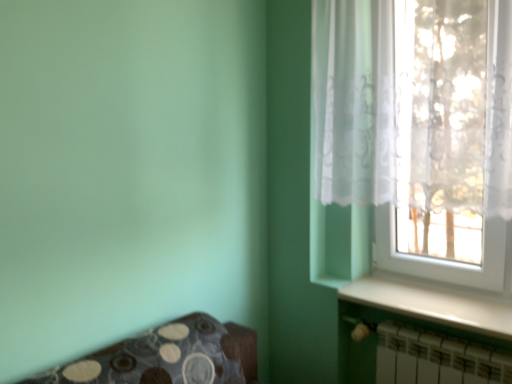
Question: Considering the relative sizes of translucent fabric at upper right and white metallic radiator at lower right in the image provided, is translucent fabric at upper right wider than white metallic radiator at lower right?

Choices:
 (A) no
 (B) yes

Answer: (B)

Question: Is there a large distance between translucent fabric at upper right and white metallic radiator at lower right?

Choices:
 (A) no
 (B) yes

Answer: (A)

Question: Could white metallic radiator at lower right be considered to be inside translucent fabric at upper right?

Choices:
 (A) no
 (B) yes

Answer: (A)

Question: From a real-world perspective, does translucent fabric at upper right stand above white metallic radiator at lower right?

Choices:
 (A) no
 (B) yes

Answer: (B)

Question: Considering the relative sizes of translucent fabric at upper right and white metallic radiator at lower right in the image provided, is translucent fabric at upper right thinner than white metallic radiator at lower right?

Choices:
 (A) yes
 (B) no

Answer: (B)

Question: From the image's perspective, is white metallic radiator at lower right located above or below white glossy window sill at lower right?

Choices:
 (A) below
 (B) above

Answer: (A)

Question: Considering the positions of white metallic radiator at lower right and white glossy window sill at lower right in the image, is white metallic radiator at lower right wider or thinner than white glossy window sill at lower right?

Choices:
 (A) wide
 (B) thin

Answer: (B)

Question: Does point (399, 359) appear closer or farther from the camera than point (466, 304)?

Choices:
 (A) closer
 (B) farther

Answer: (A)

Question: Is white metallic radiator at lower right taller or shorter than white glossy window sill at lower right?

Choices:
 (A) tall
 (B) short

Answer: (A)

Question: Considering the positions of white metallic radiator at lower right and translucent fabric at upper right in the image, is white metallic radiator at lower right bigger or smaller than translucent fabric at upper right?

Choices:
 (A) small
 (B) big

Answer: (A)

Question: From the image's perspective, is white metallic radiator at lower right located above or below translucent fabric at upper right?

Choices:
 (A) above
 (B) below

Answer: (B)

Question: In terms of width, does white metallic radiator at lower right look wider or thinner when compared to translucent fabric at upper right?

Choices:
 (A) thin
 (B) wide

Answer: (A)

Question: From a real-world perspective, relative to translucent fabric at upper right, is white metallic radiator at lower right vertically above or below?

Choices:
 (A) below
 (B) above

Answer: (A)

Question: Would you say translucent fabric at upper right is to the left or to the right of white metallic radiator at lower right in the picture?

Choices:
 (A) right
 (B) left

Answer: (B)

Question: In the image, is translucent fabric at upper right positioned in front of or behind white metallic radiator at lower right?

Choices:
 (A) front
 (B) behind

Answer: (A)